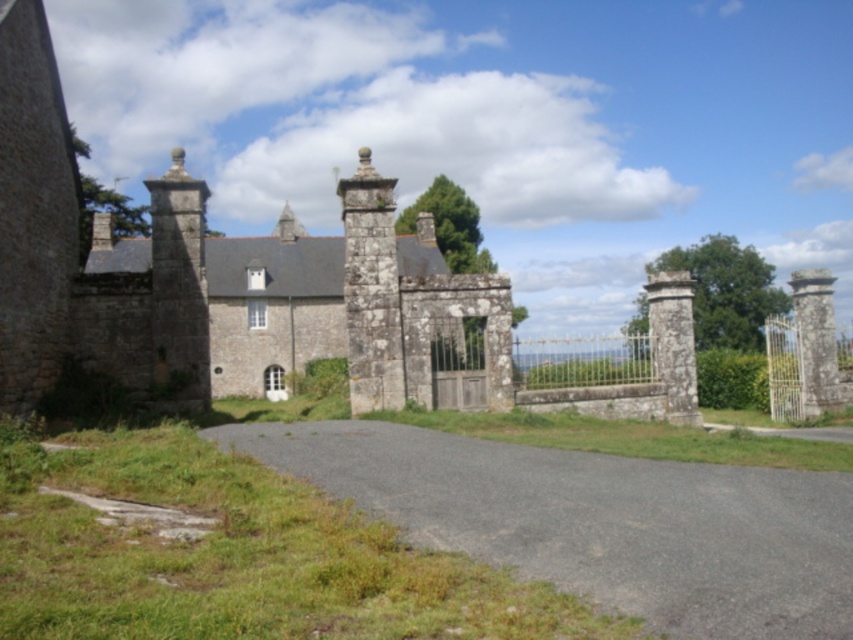
You are standing at the entrance of the grand stone gatehouse and notice two points marked on the road leading up to it. The first point is located at coordinates point (735,548) and the second at point (804,378). If you want to place a decorative stone on the point that is closer to you, which coordinate should you choose?

You should choose point (735,548) because it is closer to the camera than point (804,378).

You are driving a large delivery truck that is 2.5 meters wide. You need to enter the estate through the gatehouse. Can your truck fit through the wooden gate at center if you drive along the gray asphalt driveway at center?

The gray asphalt driveway at center is wider than the wooden gate at center. Therefore, the truck can fit through the wooden gate at center as long as it stays centered on the driveway.